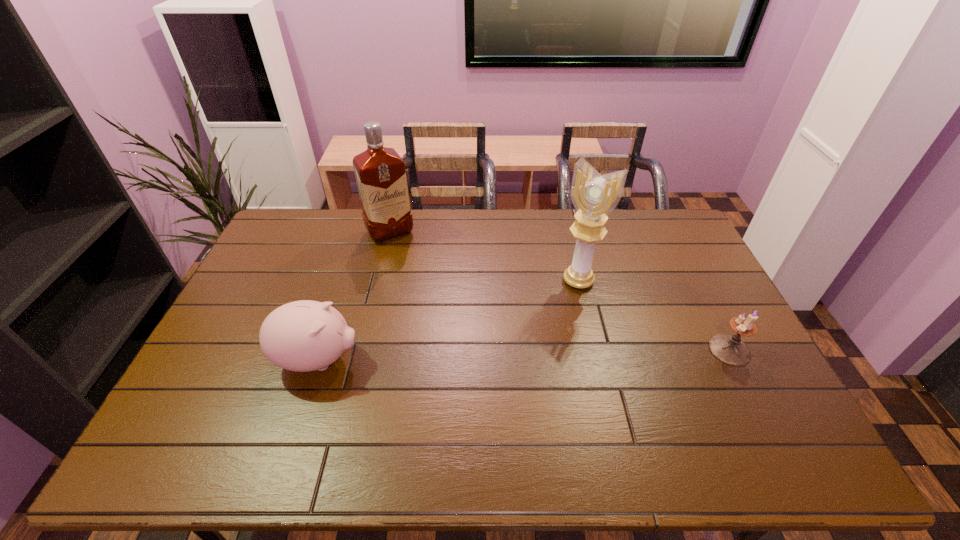
Where is `object that is the closest to the piggy bank`? The height and width of the screenshot is (540, 960). object that is the closest to the piggy bank is located at coordinates (380, 172).

Locate an element on the screen. The width and height of the screenshot is (960, 540). vacant space that satisfies the following two spatial constraints: 1. on the front side of the farthest object; 2. on the right side of the third nearest object is located at coordinates (378, 281).